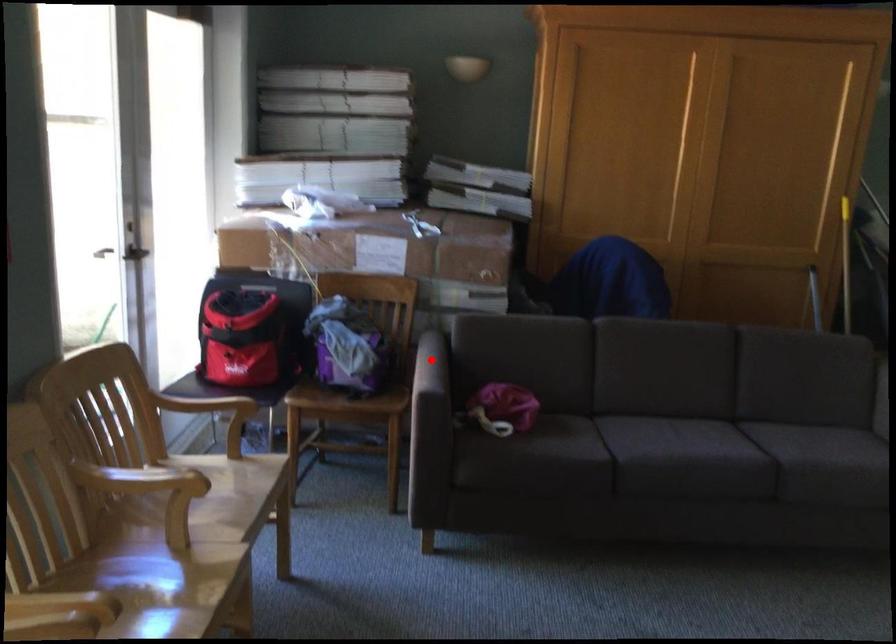
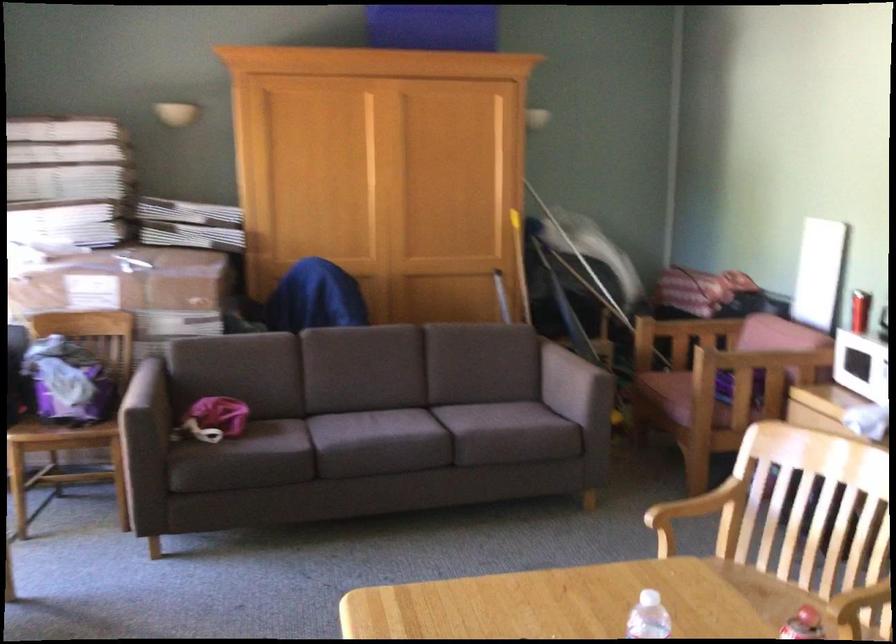
Question: I am providing you with two images of the same scene from different viewpoints. A red point is shown in image1. For the corresponding object point in image2, is it positioned nearer or farther from the camera?

Choices:
 (A) Nearer
 (B) Farther

Answer: (B)